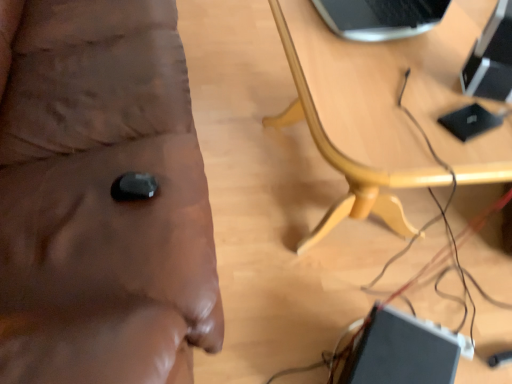
Question: From the image's perspective, relative to black glossy computer at upper right, is wooden table at center above or below?

Choices:
 (A) below
 (B) above

Answer: (B)

Question: Is wooden table at center bigger or smaller than black glossy computer at upper right?

Choices:
 (A) big
 (B) small

Answer: (A)

Question: Which of these objects is positioned closest to the wooden table at center?

Choices:
 (A) black glossy laptop at lower right
 (B) wooden table at center
 (C) black glossy computer at upper right

Answer: (B)

Question: Which object is the closest to the wooden table at center?

Choices:
 (A) black glossy laptop at lower right
 (B) wooden table at center
 (C) black glossy computer at upper right

Answer: (B)